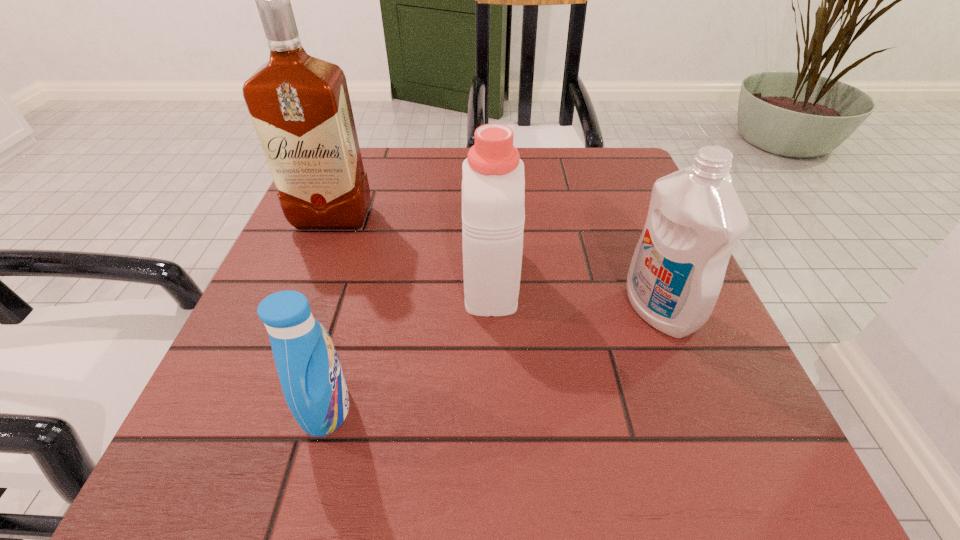
Locate which detergent ranks in proximity to the nearest detergent. Please provide its 2D coordinates. Your answer should be formatted as a tuple, i.e. [(x, y)], where the tuple contains the x and y coordinates of a point satisfying the conditions above.

[(493, 186)]

The width and height of the screenshot is (960, 540). I want to click on vacant region that satisfies the following two spatial constraints: 1. on the front label of the farthest object; 2. on the right side of the rightmost object, so click(297, 310).

The width and height of the screenshot is (960, 540). I want to click on vacant region that satisfies the following two spatial constraints: 1. on the front label of the tallest object; 2. on the left side of the rightmost detergent, so point(297,310).